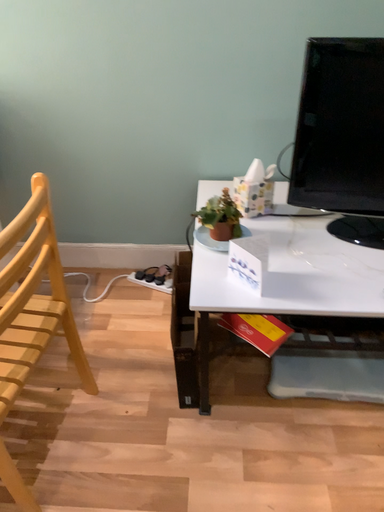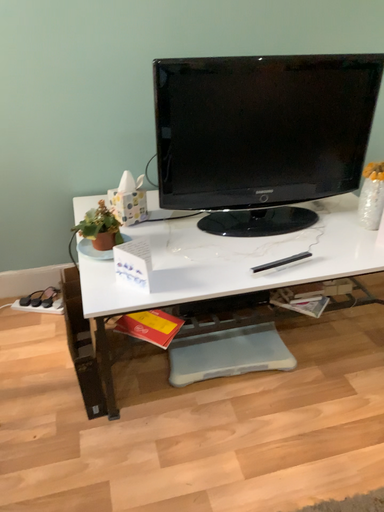
Question: Which way did the camera rotate in the video?

Choices:
 (A) rotated left
 (B) rotated right

Answer: (B)